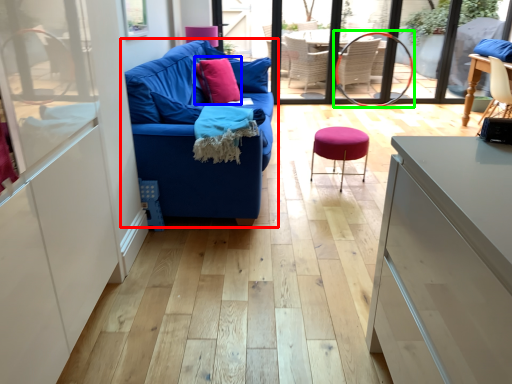
Question: Which is farther away from studio couch (highlighted by a red box)? throw pillow (highlighted by a blue box) or armchair (highlighted by a green box)?

Choices:
 (A) throw pillow
 (B) armchair

Answer: (B)